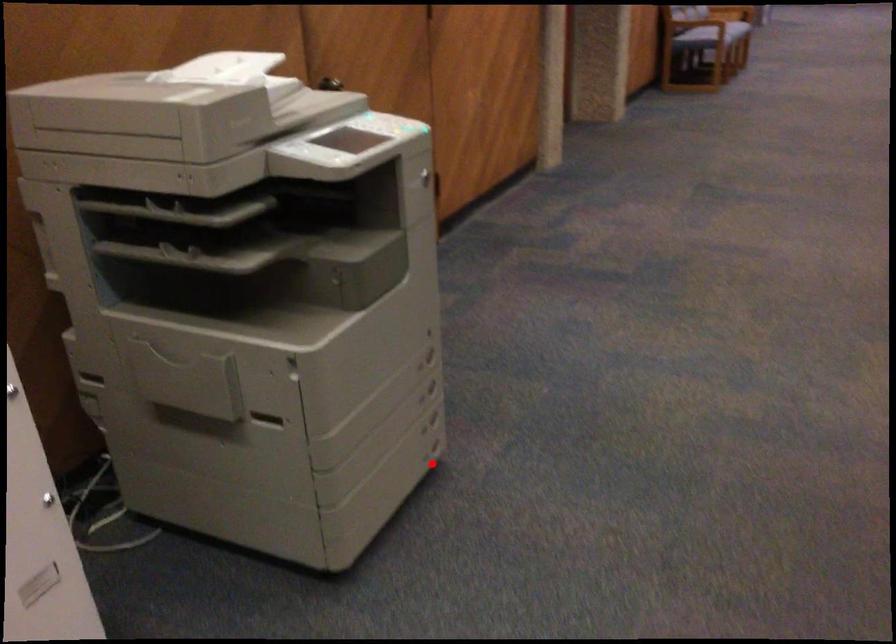
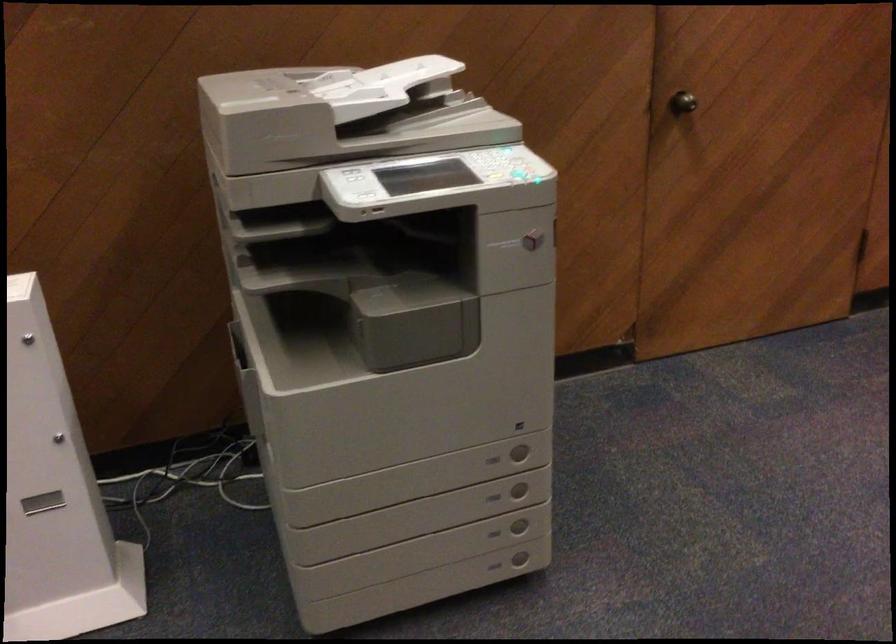
Question: I am providing you with two images of the same scene from different viewpoints. In image1, a red point is highlighted. Considering the same 3D point in image2, which of the following is correct?

Choices:
 (A) It is closer
 (B) It is farther

Answer: (A)